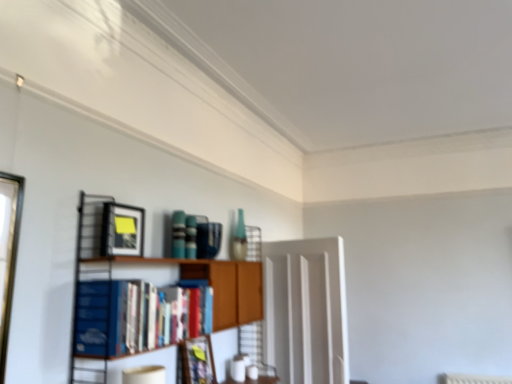
Question: Considering their positions, is wooden bookshelf at center located in front of or behind blue hardcover book at left?

Choices:
 (A) behind
 (B) front

Answer: (B)

Question: Is point (176, 322) positioned closer to the camera than point (123, 302)?

Choices:
 (A) farther
 (B) closer

Answer: (A)

Question: Which is farther from the transparent glass door at center?

Choices:
 (A) blue hardcover book at left
 (B) matte black picture frame at upper left, positioned as the 1th picture frame in left-to-right order
 (C) matte black picture frame at center, acting as the 2th picture frame starting from the front
 (D) wooden bookshelf at center

Answer: (B)

Question: Based on their relative distances, which object is nearer to the matte black picture frame at upper left, which is the 2th picture frame from right to left?

Choices:
 (A) wooden bookshelf at center
 (B) transparent glass door at center
 (C) blue hardcover book at left
 (D) matte black picture frame at center, the first picture frame ordered from the bottom

Answer: (A)